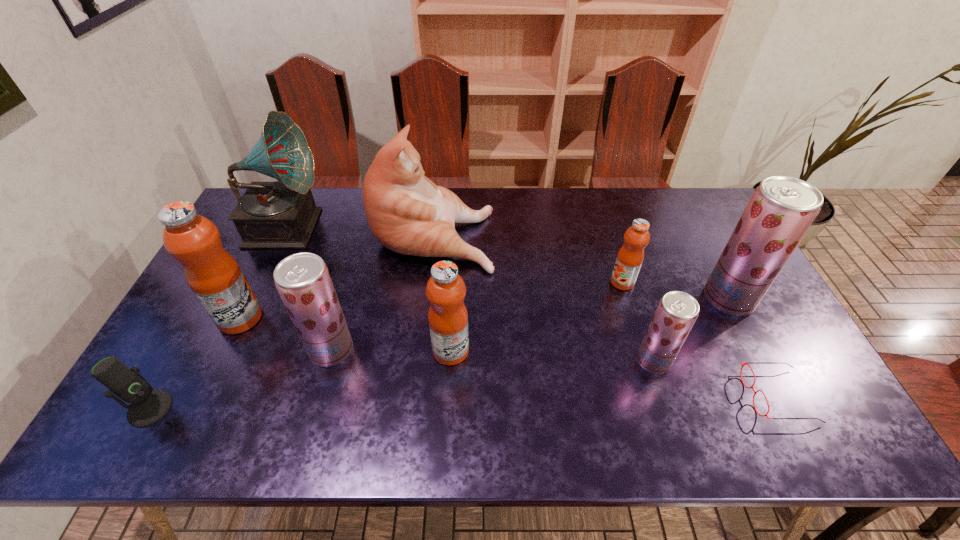
This screenshot has height=540, width=960. In order to click on free point between the second smallest strawberry fruit juice and the second shortest object in this screenshot , I will do `click(241, 379)`.

Where is `vacant space in between the leftmost orange fruit juice and the cat`? vacant space in between the leftmost orange fruit juice and the cat is located at coordinates (337, 276).

Where is `free point between the second shortest object and the smallest orange fruit juice`? free point between the second shortest object and the smallest orange fruit juice is located at coordinates (386, 345).

The image size is (960, 540). In order to click on object that is the second closest to the biggest strawberry fruit juice in this screenshot , I will do `click(630, 257)`.

Point out which object is positioned as the third nearest to the record player. Please provide its 2D coordinates. Your answer should be formatted as a tuple, i.e. [(x, y)], where the tuple contains the x and y coordinates of a point satisfying the conditions above.

[(303, 281)]

Identify the location of the closest fruit juice relative to the record player. (214, 276).

Identify which fruit juice is the fourth nearest to the record player. Please provide its 2D coordinates. Your answer should be formatted as a tuple, i.e. [(x, y)], where the tuple contains the x and y coordinates of a point satisfying the conditions above.

[(630, 257)]

Identify the location of strawberry fruit juice that is the third closest to the cat. (781, 210).

Identify which strawberry fruit juice is the third nearest to the farthest orange fruit juice. Please provide its 2D coordinates. Your answer should be formatted as a tuple, i.e. [(x, y)], where the tuple contains the x and y coordinates of a point satisfying the conditions above.

[(303, 281)]

At what (x,y) coordinates should I click in order to perform the action: click on orange fruit juice that can be found as the second closest to the leftmost strawberry fruit juice. Please return your answer as a coordinate pair (x, y). This screenshot has height=540, width=960. Looking at the image, I should click on tap(448, 318).